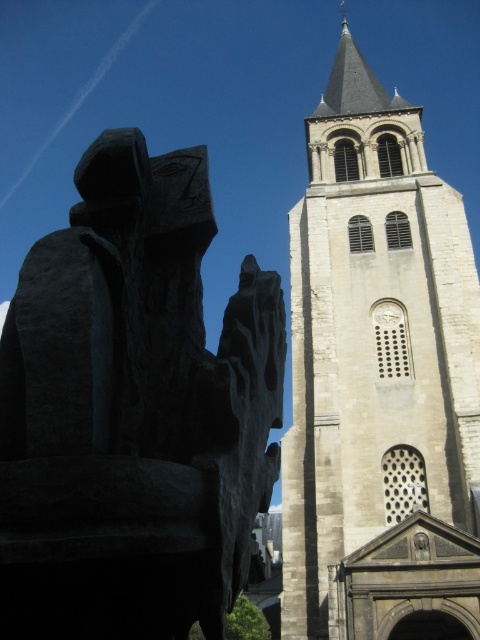
What do you see at coordinates (132, 410) in the screenshot?
I see `black stone sculpture at left` at bounding box center [132, 410].

Which is above, black stone sculpture at left or beige stone tower at center?

beige stone tower at center is higher up.

Is point (204, 202) positioned in front of point (396, 326)?

Yes.

Locate an element on the screen. black stone sculpture at left is located at coordinates (132, 410).